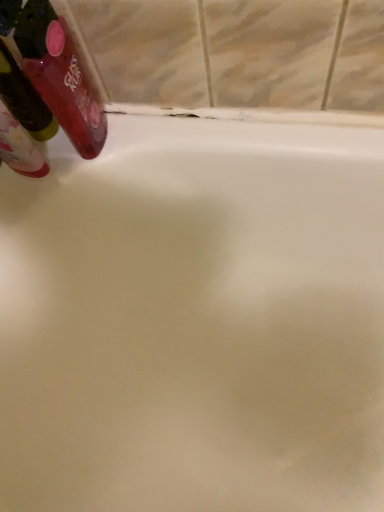
Image resolution: width=384 pixels, height=512 pixels. Identify the location of vacant area that is in front of translucent plastic mouthwash at upper left, the 1th mouthwash when ordered from left to right. (30, 222).